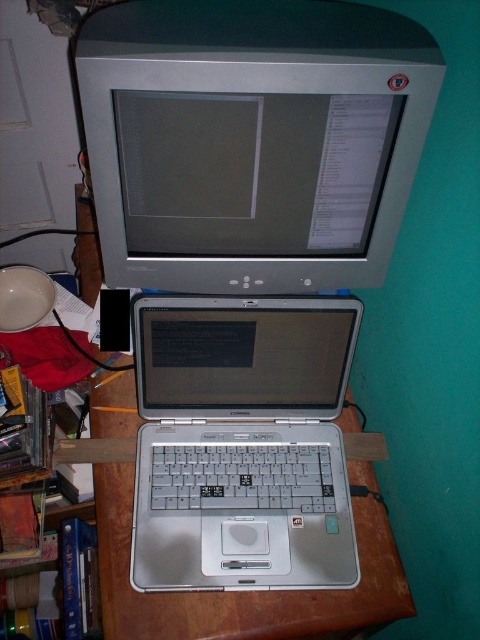
Question: Is satin silver monitor at upper center thinner than silver metallic laptop at center?

Choices:
 (A) no
 (B) yes

Answer: (A)

Question: Can you confirm if satin silver monitor at upper center is wider than silver metallic laptop at center?

Choices:
 (A) yes
 (B) no

Answer: (A)

Question: Considering the relative positions of satin silver monitor at upper center and silver metallic laptop at center in the image provided, where is satin silver monitor at upper center located with respect to silver metallic laptop at center?

Choices:
 (A) right
 (B) left

Answer: (A)

Question: Which object is farther from the camera taking this photo?

Choices:
 (A) silver metallic laptop at center
 (B) satin silver monitor at upper center

Answer: (A)

Question: Which object is farther from the camera taking this photo?

Choices:
 (A) satin silver monitor at upper center
 (B) silver metallic laptop at center

Answer: (B)